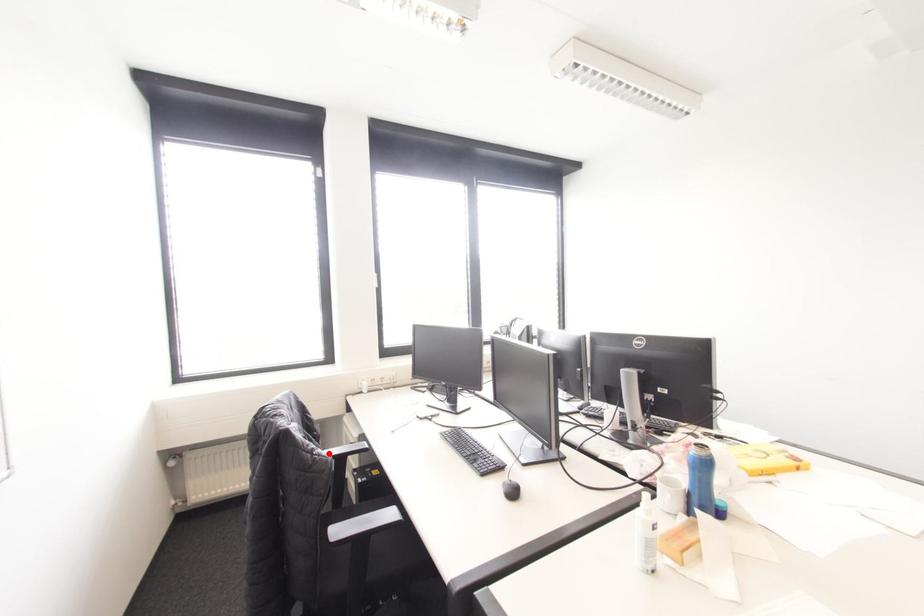
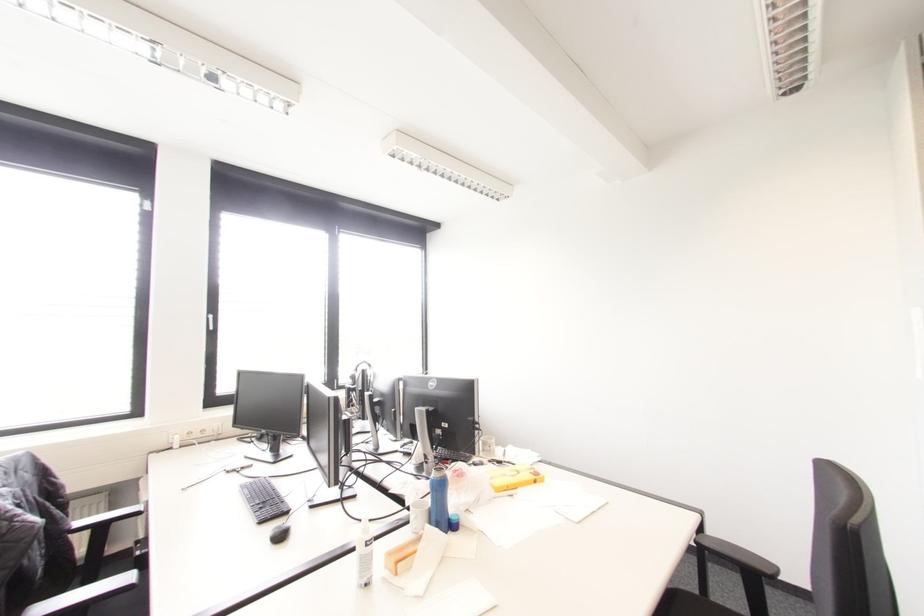
Question: I am providing you with two images of the same scene from different viewpoints. In image1, a red point is highlighted. Considering the same 3D point in image2, which of the following is correct?

Choices:
 (A) It is closer
 (B) It is farther

Answer: (A)